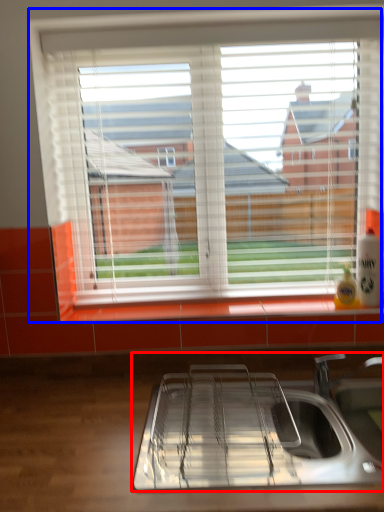
Question: Among these objects, which one is nearest to the camera, sink (highlighted by a red box) or window (highlighted by a blue box)?

Choices:
 (A) sink
 (B) window

Answer: (A)